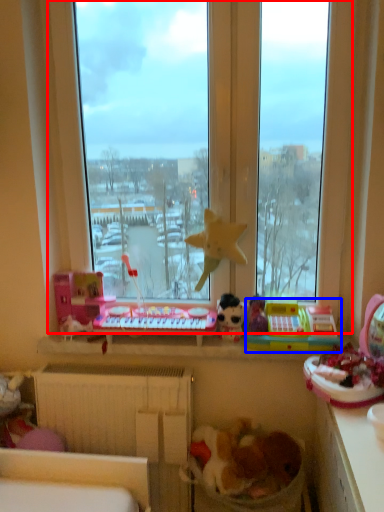
Question: Which point is closer to the camera, window (highlighted by a red box) or toy (highlighted by a blue box)?

Choices:
 (A) window
 (B) toy

Answer: (A)